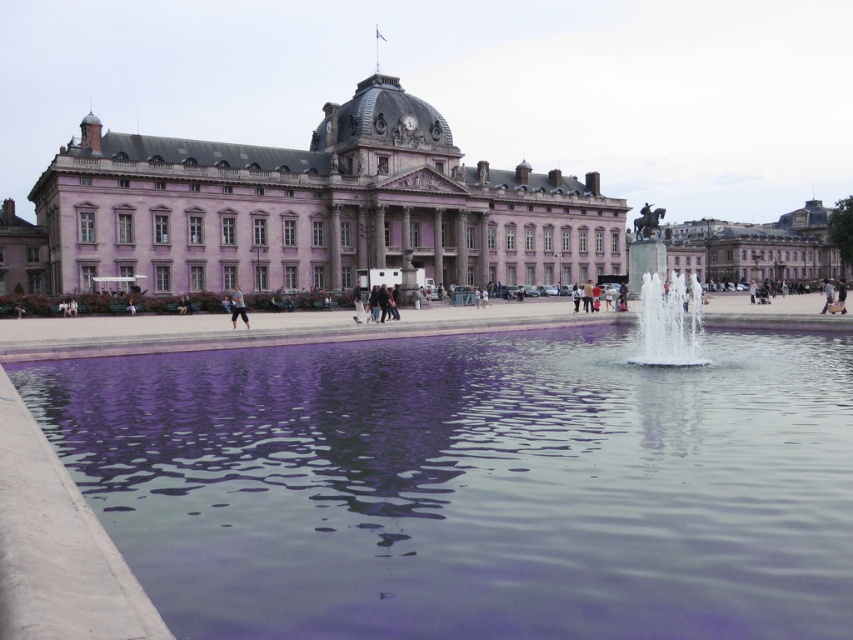
Question: Which object appears closest to the camera in this image?

Choices:
 (A) dark gray fabric pants at center
 (B) light brown leather jacket at center

Answer: (B)

Question: Which object is farther from the camera taking this photo?

Choices:
 (A) light brown leather jacket at center
 (B) clear glass fountain at center
 (C) pink stone palace at center
 (D) transparent glass water at center

Answer: (C)

Question: Does transparent glass water at center have a smaller size compared to light brown leather jacket at center?

Choices:
 (A) no
 (B) yes

Answer: (A)

Question: Is transparent glass water at center above light brown leather jacket at center?

Choices:
 (A) yes
 (B) no

Answer: (B)

Question: Is pink stone palace at center positioned before clear glass fountain at center?

Choices:
 (A) no
 (B) yes

Answer: (A)

Question: Which point is closer to the camera taking this photo?

Choices:
 (A) (360, 296)
 (B) (225, 161)
 (C) (660, 449)
 (D) (235, 317)

Answer: (C)